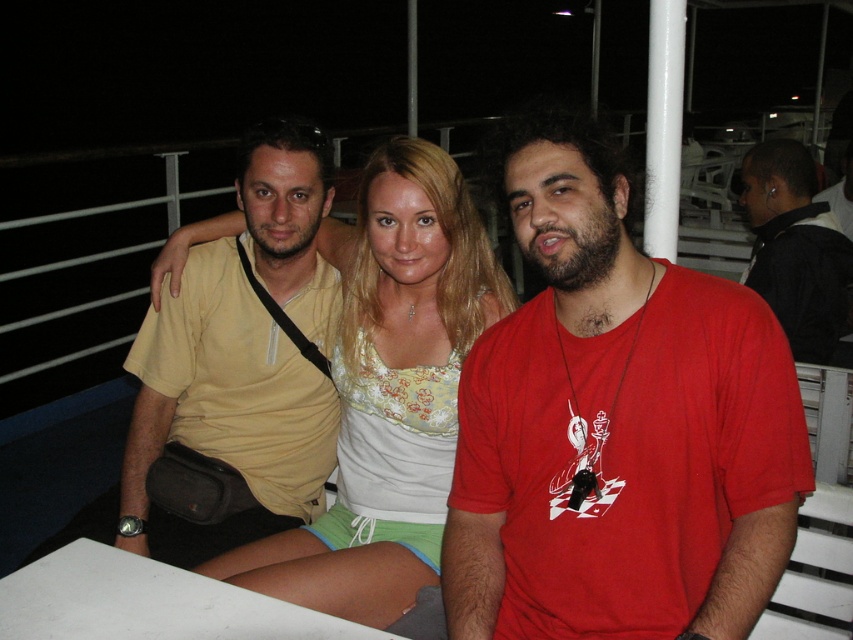
Which is more to the left, matte red t-shirt at center or black leather jacket at right?

Positioned to the left is matte red t-shirt at center.

Who is shorter, matte red t-shirt at center or black leather jacket at right?

black leather jacket at right

Locate an element on the screen. The image size is (853, 640). matte red t-shirt at center is located at coordinates (616, 426).

Find the location of a particular element. matte red t-shirt at center is located at coordinates (616, 426).

Can you confirm if light beige fabric top at center is bigger than matte yellow shirt at center?

Yes.

Is light beige fabric top at center below matte yellow shirt at center?

Correct, light beige fabric top at center is located below matte yellow shirt at center.

Where is `light beige fabric top at center`? This screenshot has height=640, width=853. light beige fabric top at center is located at coordinates (390, 394).

This screenshot has width=853, height=640. What are the coordinates of `matte red t-shirt at center` in the screenshot? It's located at (x=616, y=426).

Does matte red t-shirt at center have a greater width compared to matte yellow shirt at center?

No.

What do you see at coordinates (616, 426) in the screenshot?
I see `matte red t-shirt at center` at bounding box center [616, 426].

Where is `matte red t-shirt at center`? The height and width of the screenshot is (640, 853). matte red t-shirt at center is located at coordinates (616, 426).